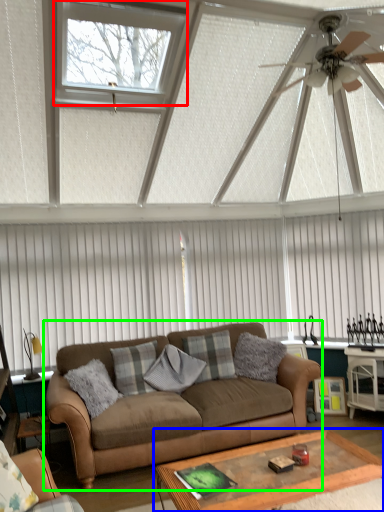
Question: Considering the real-world distances, which object is closest to window (highlighted by a red box)? coffee table (highlighted by a blue box) or studio couch (highlighted by a green box).

Choices:
 (A) coffee table
 (B) studio couch

Answer: (B)